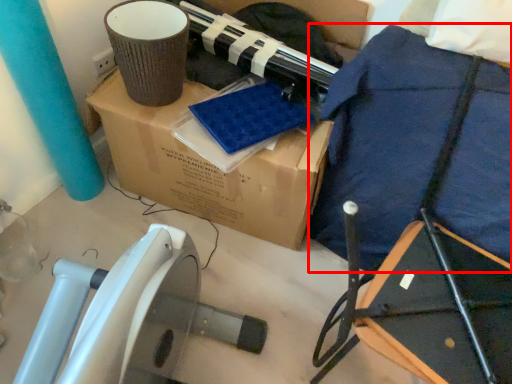
Question: Where is blanket (annotated by the red box) located in relation to box in the image?

Choices:
 (A) right
 (B) left

Answer: (A)